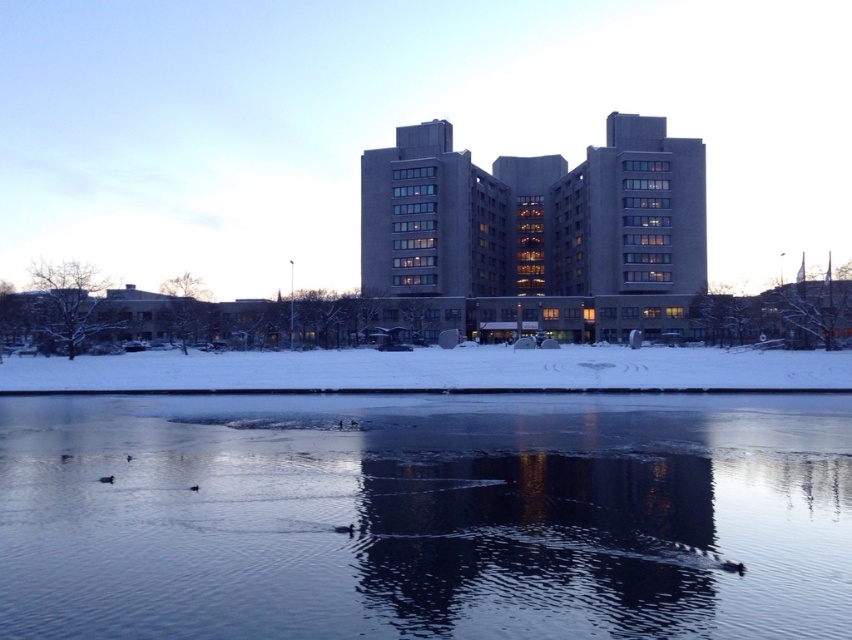
Does point (620, 492) lie in front of point (513, 330)?

Yes, it is in front of point (513, 330).

Where is `transparent ice at center`? The width and height of the screenshot is (852, 640). transparent ice at center is located at coordinates (426, 516).